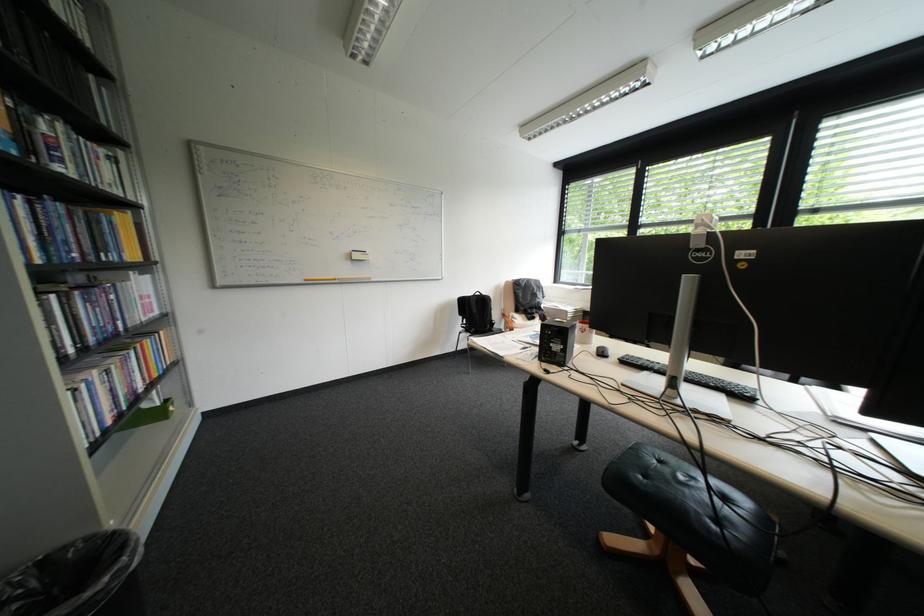
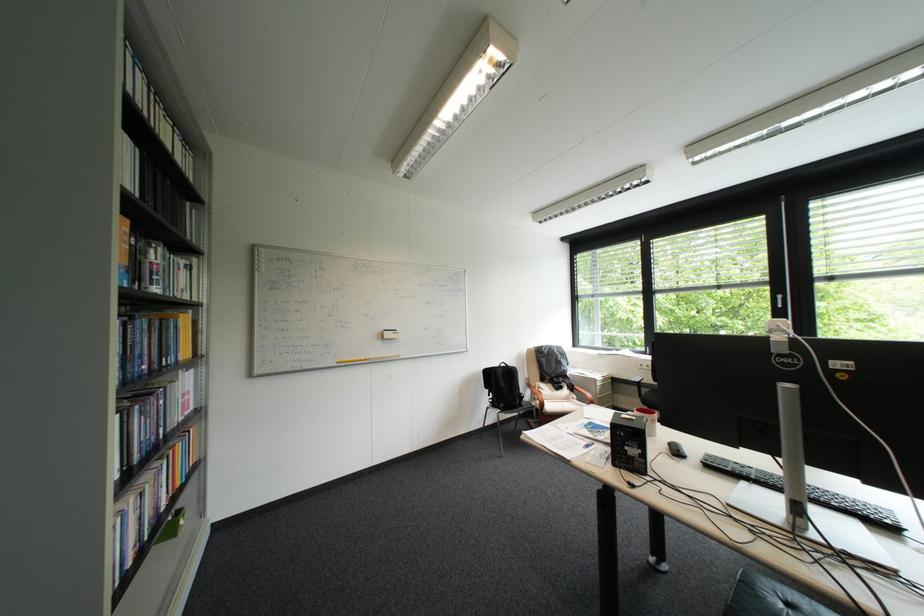
Find the pixel in the second image that matches point 544,321 in the first image.

(573, 391)